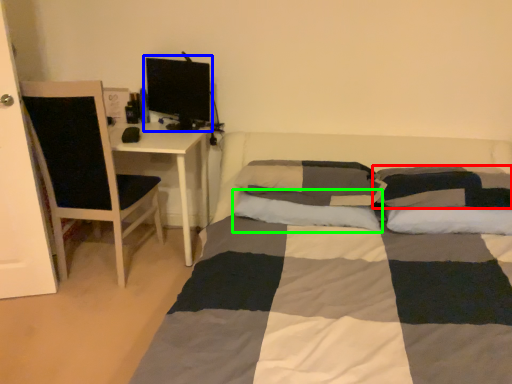
Question: Estimate the real-world distances between objects in this image. Which object is closer to pillow (highlighted by a red box), computer monitor (highlighted by a blue box) or pillow (highlighted by a green box)?

Choices:
 (A) computer monitor
 (B) pillow

Answer: (B)